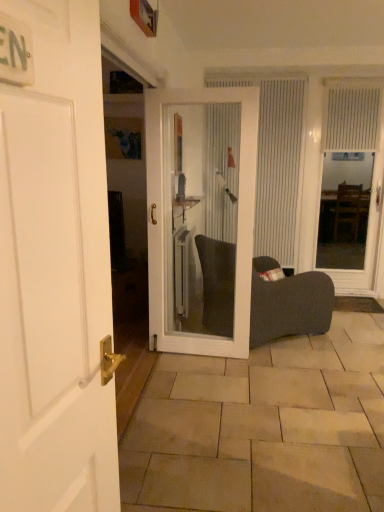
At what (x,y) coordinates should I click in order to perform the action: click on free point above beige stone tile at lower center (from a real-world perspective). Please return your answer as a coordinate pair (x, y). Looking at the image, I should click on (292, 388).